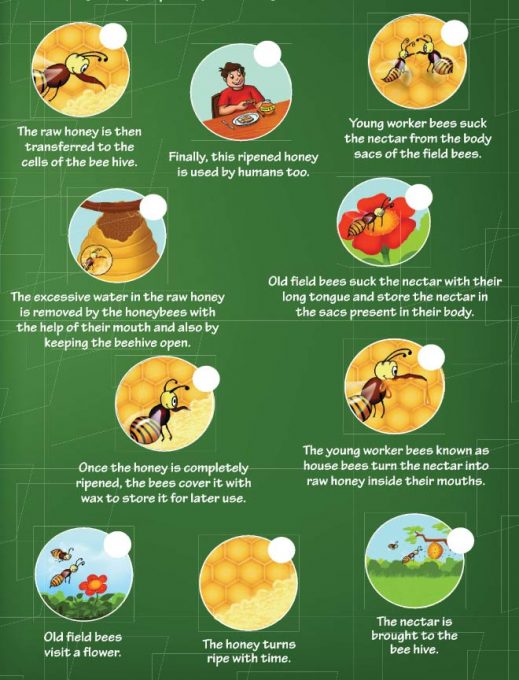
Where is `brown haired boy with red shirt sitting at table and eating`? Image resolution: width=519 pixels, height=680 pixels. brown haired boy with red shirt sitting at table and eating is located at coordinates (234, 94).